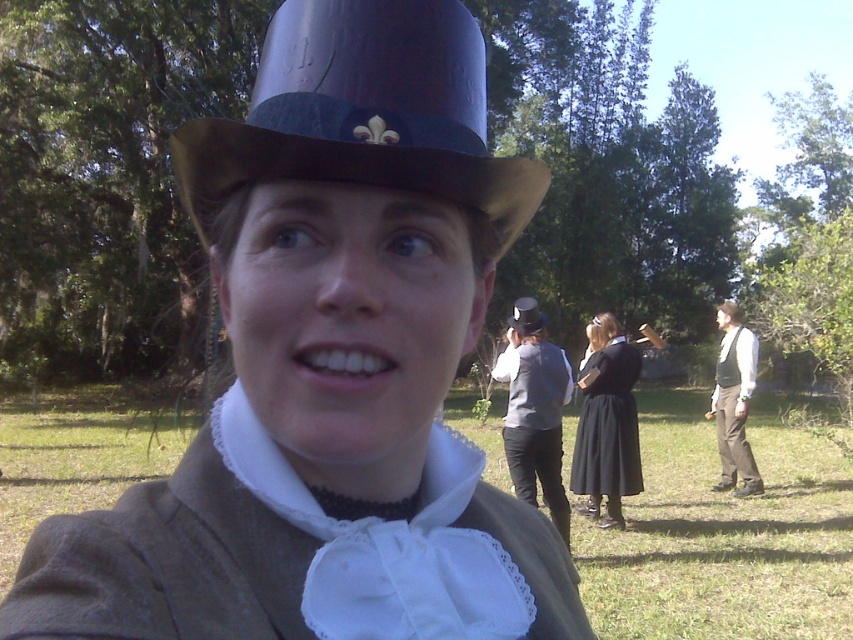
You are standing at the point labeled point (287, 148) and want to walk to the point labeled point (717, 397). Which direction should you move in relation to the camera?

You should move away from the camera because point (717, 397) is further from the camera than point (287, 148).

From the picture: You are a costume designer preparing for a historical play. You have two items from the scene provided. Which item is smaller in size between the matte black top hat at upper center and the matte gray vest at center?

The matte black top hat at upper center is smaller in size compared to the matte gray vest at center according to the description.